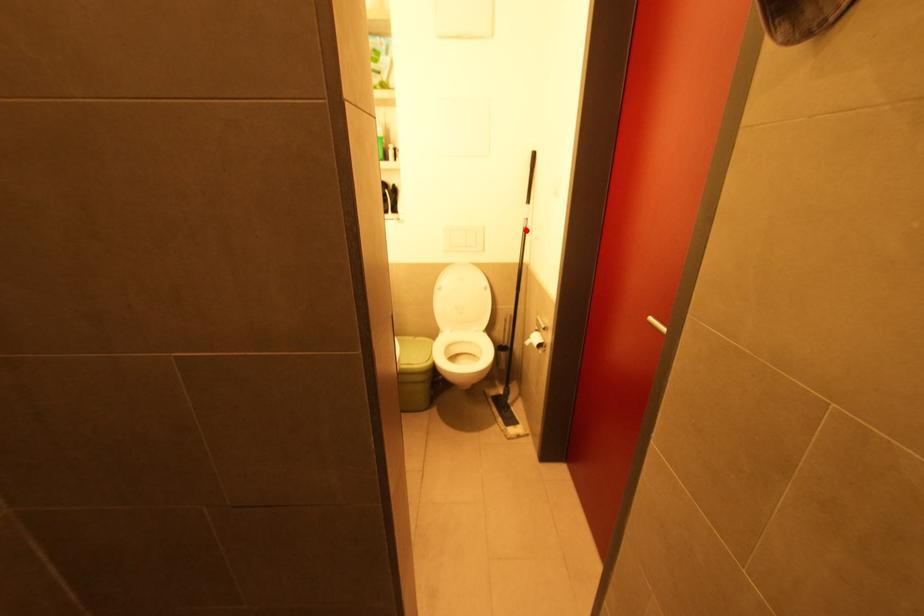
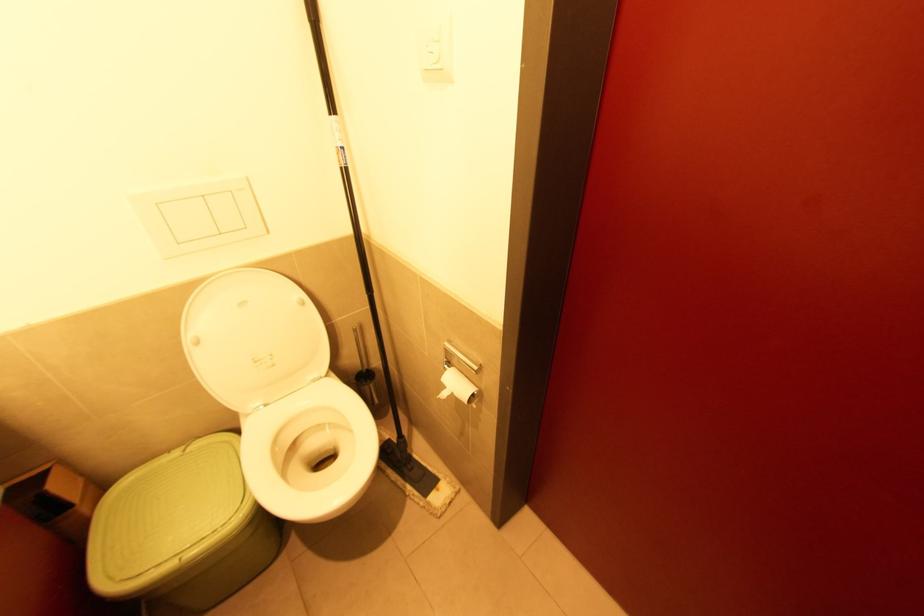
Where in the second image is the point corresponding to the highlighted location from the first image?

(347, 172)